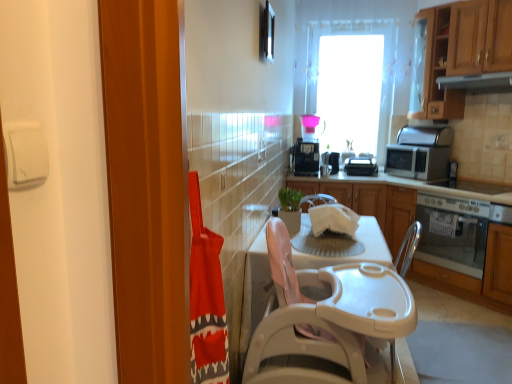
Question: Is white plastic table at center, which is the first table from front to back, to the left of silver metallic microwave at right, which appears as the 4th appliance when viewed from the left, from the viewer's perspective?

Choices:
 (A) yes
 (B) no

Answer: (A)

Question: Considering the relative positions of white plastic table at center, which ranks as the 2th table in back-to-front order, and silver metallic microwave at right, which is the first appliance in right-to-left order, in the image provided, is white plastic table at center, which ranks as the 2th table in back-to-front order, to the right of silver metallic microwave at right, which is the first appliance in right-to-left order, from the viewer's perspective?

Choices:
 (A) no
 (B) yes

Answer: (A)

Question: From a real-world perspective, is white plastic table at center, which ranks as the 2th table in back-to-front order, on top of silver metallic microwave at right, which is the first appliance in right-to-left order?

Choices:
 (A) yes
 (B) no

Answer: (B)

Question: Could you tell me if white plastic table at center, which ranks as the 2th table in back-to-front order, is facing silver metallic microwave at right, which is the first appliance in right-to-left order?

Choices:
 (A) no
 (B) yes

Answer: (A)

Question: Is white plastic table at center, which ranks as the 2th table in back-to-front order, taller than silver metallic microwave at right, which appears as the 4th appliance when viewed from the left?

Choices:
 (A) no
 (B) yes

Answer: (B)

Question: Is white plastic table at center, which is the first table from front to back, bigger than silver metallic microwave at right, which is the first appliance in right-to-left order?

Choices:
 (A) no
 (B) yes

Answer: (B)

Question: Would you say transparent glass window at upper center is outside white plastic table at center, which is the first table from front to back?

Choices:
 (A) yes
 (B) no

Answer: (A)

Question: Does transparent glass window at upper center have a greater height compared to white plastic table at center, which ranks as the 2th table in back-to-front order?

Choices:
 (A) yes
 (B) no

Answer: (A)

Question: Is there a large distance between transparent glass window at upper center and white plastic table at center, which ranks as the 2th table in back-to-front order?

Choices:
 (A) no
 (B) yes

Answer: (B)

Question: Could you tell me if transparent glass window at upper center is turned towards white plastic table at center, which is the first table from front to back?

Choices:
 (A) yes
 (B) no

Answer: (A)

Question: Considering the relative sizes of transparent glass window at upper center and white plastic table at center, which is the first table from front to back, in the image provided, is transparent glass window at upper center wider than white plastic table at center, which is the first table from front to back,?

Choices:
 (A) yes
 (B) no

Answer: (B)

Question: From the image's perspective, is transparent glass window at upper center on top of white plastic table at center, which ranks as the 2th table in back-to-front order?

Choices:
 (A) no
 (B) yes

Answer: (B)

Question: Does white plastic toaster at center, the third appliance from the left, turn towards white plastic sink at center?

Choices:
 (A) no
 (B) yes

Answer: (B)